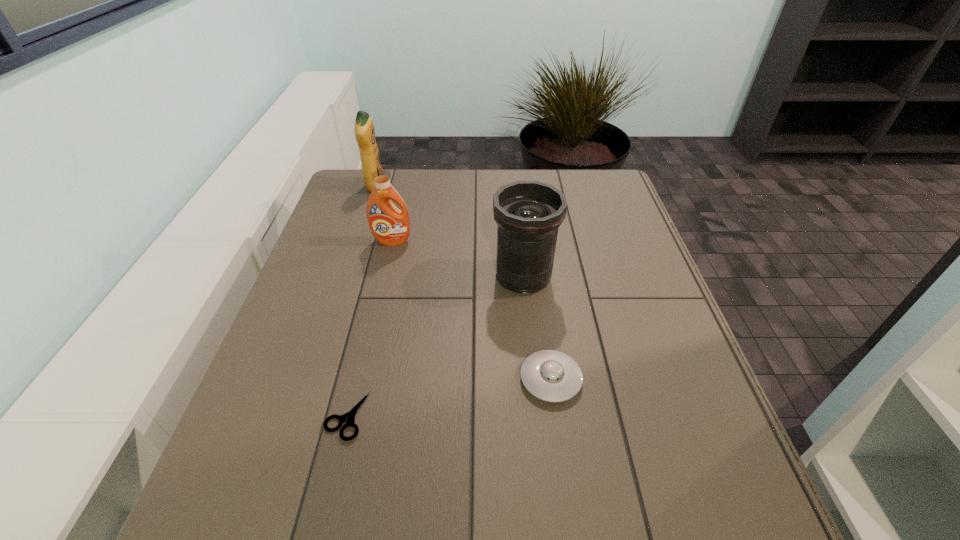
Find the location of a particular element. blank area located 0.200m on the left of the fourth tallest object is located at coordinates (423, 379).

You are a GUI agent. You are given a task and a screenshot of the screen. Output one action in this format:
    pyautogui.click(x=<x>, y=<y>)
    Task: Click on the vacant position located on the back of the shortest object
    The image size is (960, 540).
    Given the screenshot: What is the action you would take?
    pyautogui.click(x=362, y=352)

Where is `object present at the far edge`? object present at the far edge is located at coordinates (364, 130).

The height and width of the screenshot is (540, 960). I want to click on shears present at the left edge, so click(348, 418).

I want to click on object that is at the far left corner, so click(x=364, y=130).

Locate an element on the screen. Image resolution: width=960 pixels, height=540 pixels. vacant space at the far edge of the desktop is located at coordinates point(488,187).

The height and width of the screenshot is (540, 960). Identify the location of vacant point at the near edge. (502, 510).

This screenshot has width=960, height=540. I want to click on free region at the left edge, so click(359, 260).

In the image, there is a desktop. At what (x,y) coordinates should I click in order to perform the action: click on vacant space at the right edge. Please return your answer as a coordinate pair (x, y). Looking at the image, I should click on (636, 296).

Find the location of `vacant space that is in between the shears and the saucer`. vacant space that is in between the shears and the saucer is located at coordinates (448, 397).